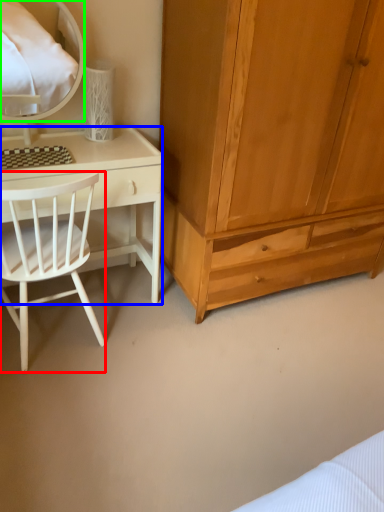
Question: Which object is the farthest from chair (highlighted by a red box)? Choose among these: desk (highlighted by a blue box) or mirror (highlighted by a green box).

Choices:
 (A) desk
 (B) mirror

Answer: (B)